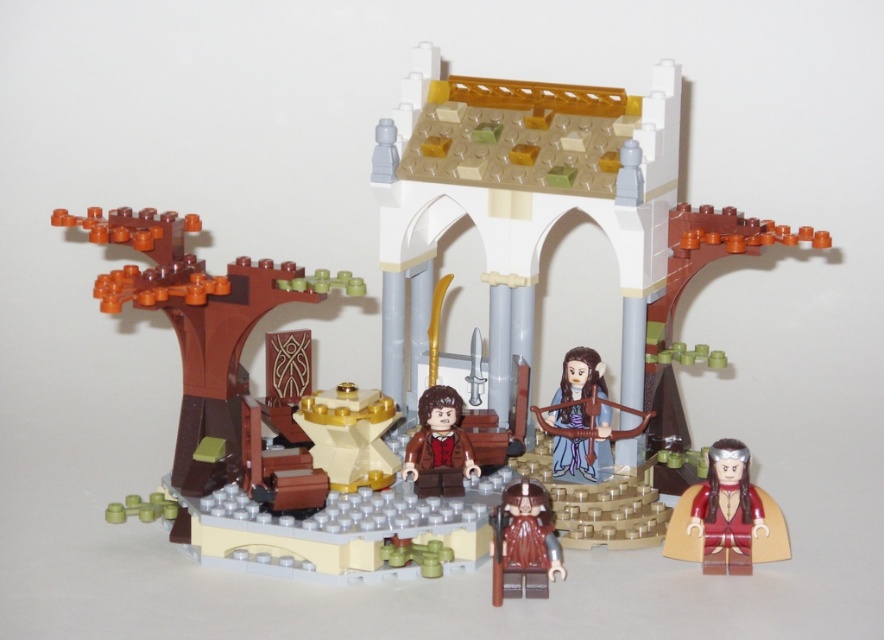
From the picture: You are standing in front of a LEGO castle set. You notice two points marked in the scene. The first point is at coordinates point (x=709, y=528) and the second point is at point (x=599, y=412). Which of these two points is closer to you?

Point (x=709, y=528) is closer to the viewer than point (x=599, y=412).